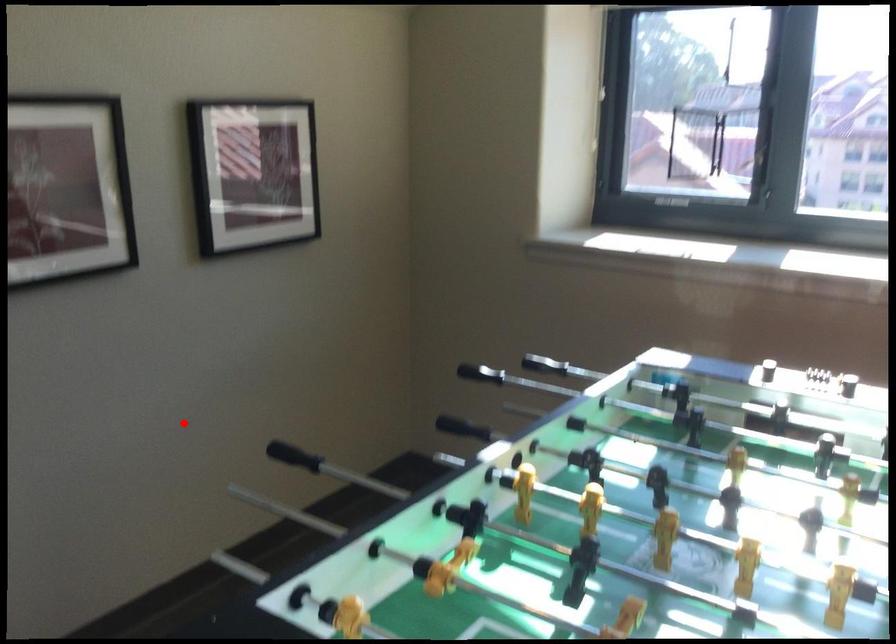
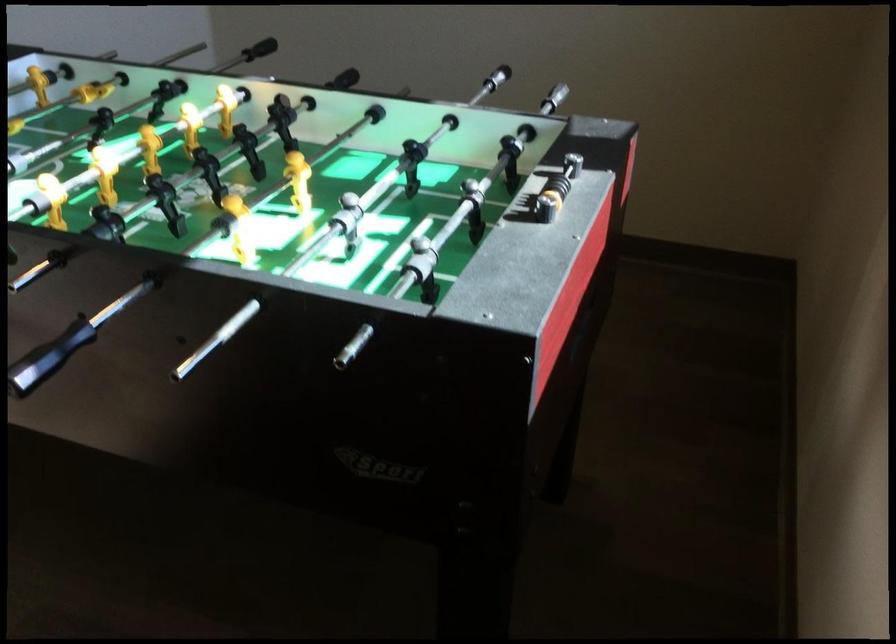
Question: I am providing you with two images of the same scene from different viewpoints. A red point is shown in image1. For the corresponding object point in image2, is it positioned nearer or farther from the camera?

Choices:
 (A) Nearer
 (B) Farther

Answer: (B)